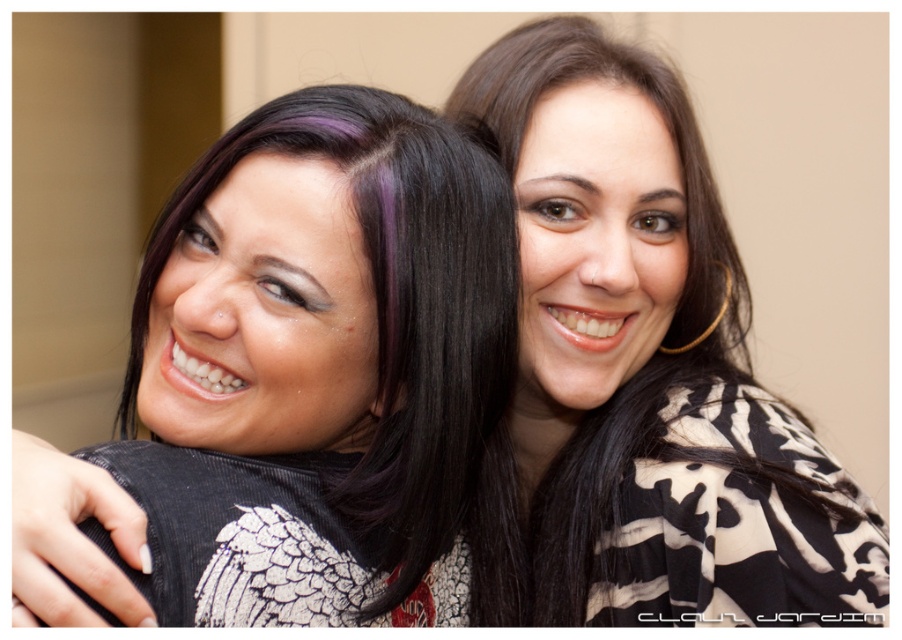
Question: Considering the relative positions of matte black hair at left and black printed shirt at center in the image provided, where is matte black hair at left located with respect to black printed shirt at center?

Choices:
 (A) right
 (B) left

Answer: (B)

Question: Which object appears closest to the camera in this image?

Choices:
 (A) black printed shirt at center
 (B) matte black hair at left

Answer: (B)

Question: Is matte black hair at left further to camera compared to black printed shirt at center?

Choices:
 (A) no
 (B) yes

Answer: (A)

Question: Where is matte black hair at left located in relation to black printed shirt at center in the image?

Choices:
 (A) left
 (B) right

Answer: (A)